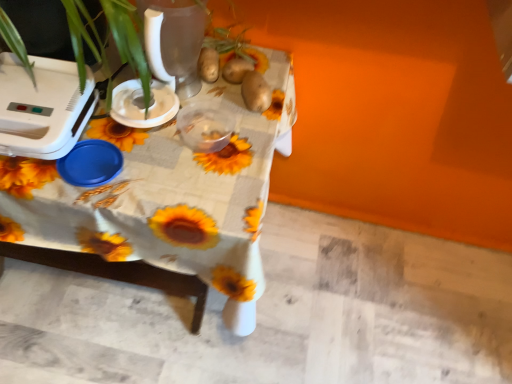
This screenshot has height=384, width=512. In order to click on free space in front of brown matte potato at center, which is the 2th potato in left-to-right order in this screenshot , I will do `click(231, 145)`.